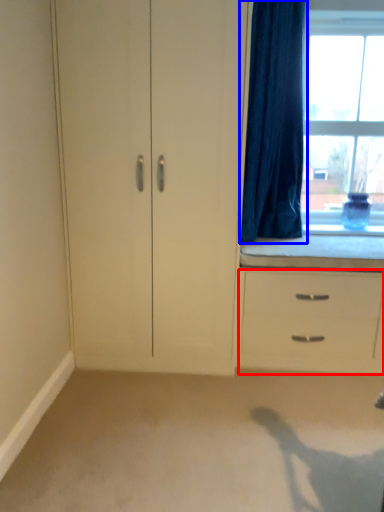
Question: Which object is further to the camera taking this photo, chest of drawers (highlighted by a red box) or curtain (highlighted by a blue box)?

Choices:
 (A) chest of drawers
 (B) curtain

Answer: (A)